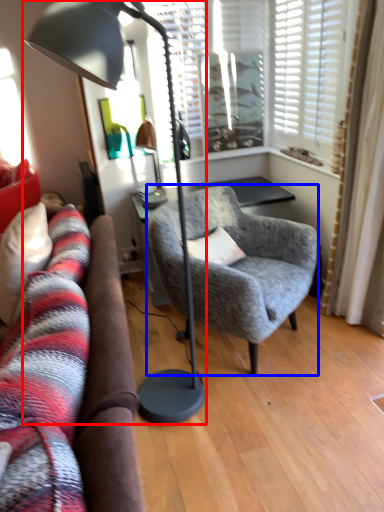
Question: Among these objects, which one is farthest to the camera, lamp (highlighted by a red box) or chair (highlighted by a blue box)?

Choices:
 (A) lamp
 (B) chair

Answer: (B)